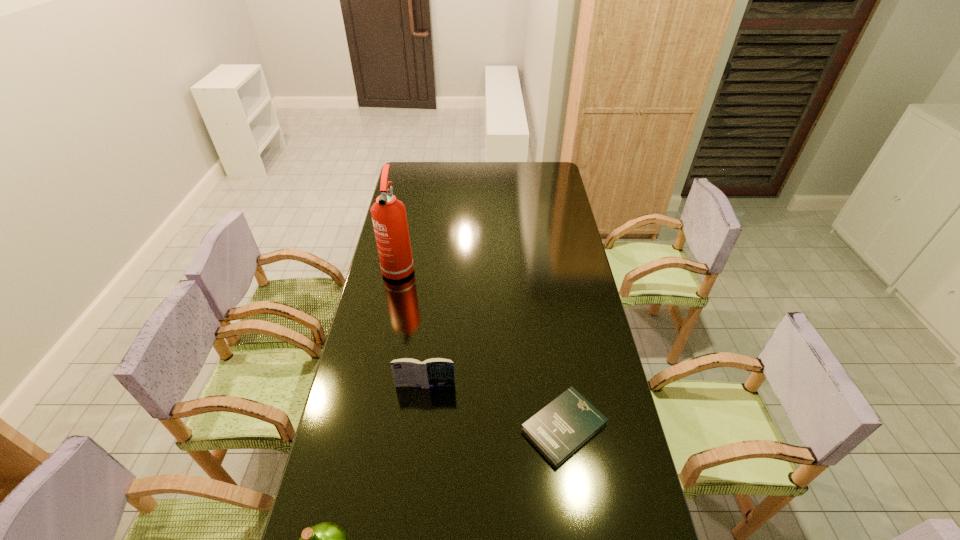
The width and height of the screenshot is (960, 540). I want to click on object that stands as the second closest to the tallest object, so click(563, 426).

Locate an element on the screen. object that can be found as the third closest to the farther book is located at coordinates (389, 218).

Identify the location of vacant space that satisfies the following two spatial constraints: 1. at the nozzle of the fire extinguisher; 2. on the right side of the third farthest object. (367, 427).

Identify the location of vacant position in the image that satisfies the following two spatial constraints: 1. on the front cover of the taller book; 2. on the right side of the second nearest object. Image resolution: width=960 pixels, height=540 pixels. (421, 427).

Locate an element on the screen. The width and height of the screenshot is (960, 540). vacant area in the image that satisfies the following two spatial constraints: 1. at the nozzle of the second nearest object; 2. on the left side of the farthest object is located at coordinates (367, 427).

What are the coordinates of `free region that satisfies the following two spatial constraints: 1. on the front cover of the taller book; 2. on the left side of the rightmost object` in the screenshot? It's located at (421, 427).